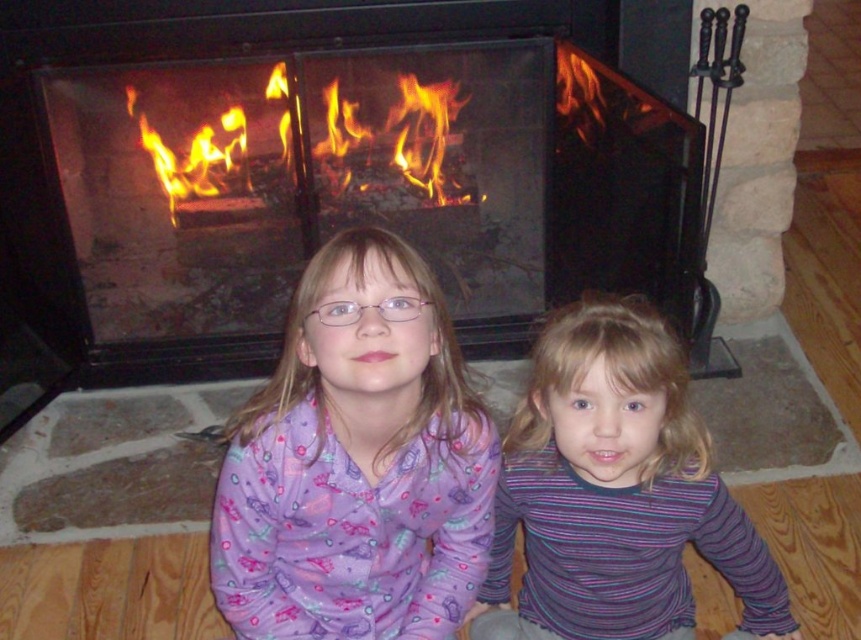
Question: Is purple fabric shirt at center smaller than black wrought iron fireplace tools at right?

Choices:
 (A) no
 (B) yes

Answer: (A)

Question: Can you confirm if purple fabric shirt at center is positioned below black wrought iron fireplace tools at right?

Choices:
 (A) no
 (B) yes

Answer: (B)

Question: Which point is closer to the camera taking this photo?

Choices:
 (A) (331, 163)
 (B) (327, 490)
 (C) (722, 84)
 (D) (523, 134)

Answer: (B)

Question: Does purple fabric shirt at center appear on the left side of flamewoodenfire at center?

Choices:
 (A) no
 (B) yes

Answer: (A)

Question: Which point is farther to the camera?

Choices:
 (A) smooth stone fireplace at center
 (B) black wrought iron fireplace tools at right

Answer: (B)

Question: Which of the following is the farthest from the observer?

Choices:
 (A) (444, 100)
 (B) (726, 369)
 (C) (500, 253)
 (D) (691, 472)

Answer: (C)